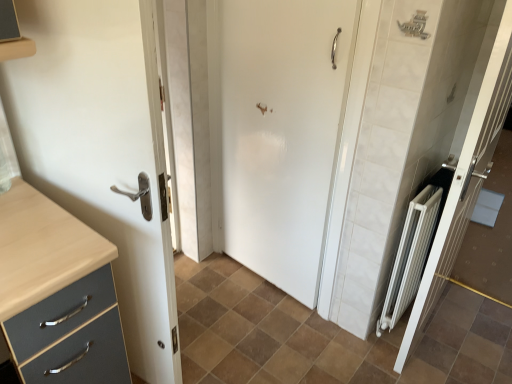
Find the location of a particular element. Image resolution: width=512 pixels, height=384 pixels. vacant area that is situated to the right of white metallic radiator at right, marked as the third door in a left-to-right arrangement is located at coordinates (476, 335).